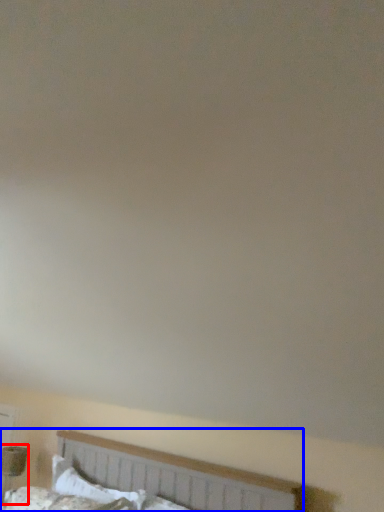
Question: Which of the following is the farthest to the observer, table lamp (highlighted by a red box) or bed (highlighted by a blue box)?

Choices:
 (A) table lamp
 (B) bed

Answer: (A)